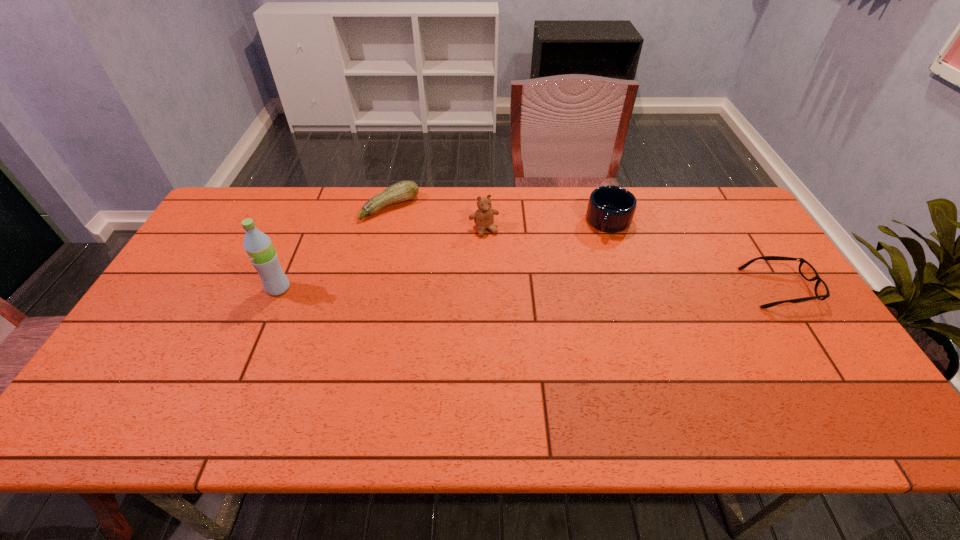
You are a GUI agent. You are given a task and a screenshot of the screen. Output one action in this format:
    pyautogui.click(x=<x>, y=<y>)
    Task: Click on the teddy bear that is at the far edge
    The image size is (960, 540).
    Given the screenshot: What is the action you would take?
    pyautogui.click(x=484, y=216)

Identify the location of zucchini located in the far edge section of the desktop. (406, 190).

Locate an element on the screen. mug at the far edge is located at coordinates (611, 209).

This screenshot has height=540, width=960. Find the location of `object that is at the right edge`. object that is at the right edge is located at coordinates 807,271.

This screenshot has width=960, height=540. Identify the location of vacant space at the far edge of the desktop. (580, 228).

Identify the location of free space at the near edge of the desktop. (689, 374).

Locate an element on the screen. vacant area at the left edge of the desktop is located at coordinates (164, 303).

In the image, there is a desktop. Identify the location of free space at the right edge. (725, 269).

Find the location of a particular element. free space between the spectacles and the third tallest object is located at coordinates (694, 255).

This screenshot has width=960, height=540. I want to click on free spot between the tallest object and the teddy bear, so click(381, 259).